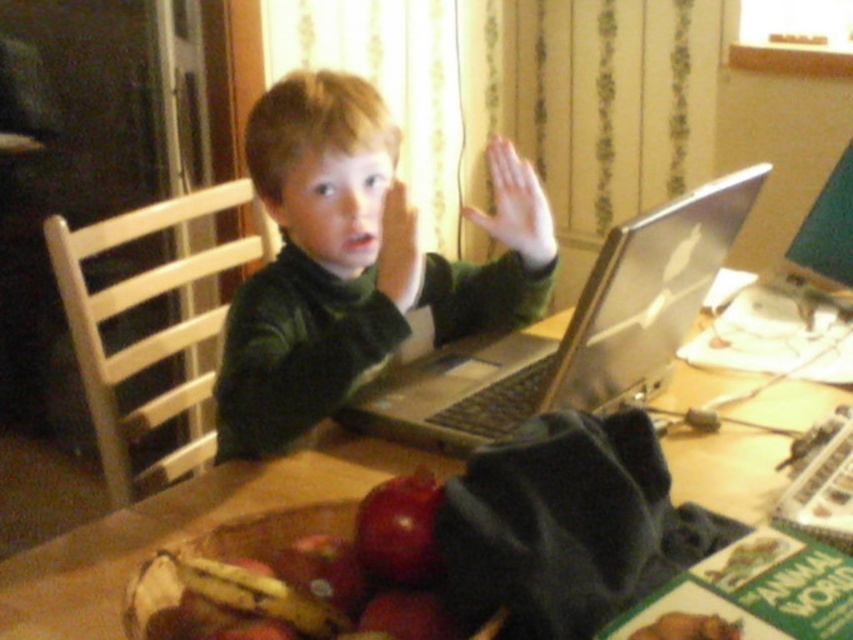
Who is lower down, green velvety sweater at center or silver metallic laptop at center?

silver metallic laptop at center

Can you confirm if green velvety sweater at center is wider than silver metallic laptop at center?

No, green velvety sweater at center is not wider than silver metallic laptop at center.

Which is in front, point (244, 356) or point (468, 381)?

Point (244, 356)

Image resolution: width=853 pixels, height=640 pixels. Find the location of `green velvety sweater at center`. green velvety sweater at center is located at coordinates (357, 262).

Does green velvety sweater at center lie behind wooden table at center?

Yes, it is.

Locate an element on the screen. green velvety sweater at center is located at coordinates (357, 262).

This screenshot has width=853, height=640. In order to click on green velvety sweater at center in this screenshot , I will do `click(357, 262)`.

At what (x,y) coordinates should I click in order to perform the action: click on green velvety sweater at center. Please return your answer as a coordinate pair (x, y). Image resolution: width=853 pixels, height=640 pixels. Looking at the image, I should click on (357, 262).

The width and height of the screenshot is (853, 640). What do you see at coordinates (357, 262) in the screenshot?
I see `green velvety sweater at center` at bounding box center [357, 262].

Image resolution: width=853 pixels, height=640 pixels. Identify the location of green velvety sweater at center. (357, 262).